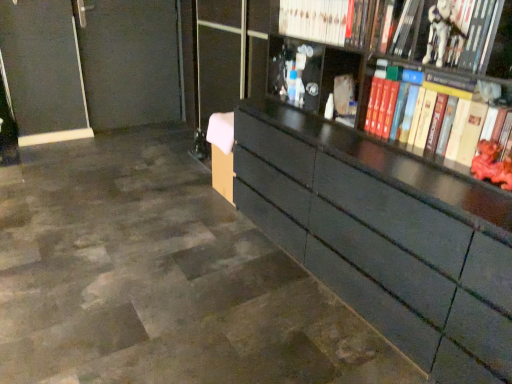
Question: From the image's perspective, is transparent glass door at center positioned above or below rubberized red toy at right, the 1th toy ordered from the bottom?

Choices:
 (A) above
 (B) below

Answer: (A)

Question: Would you say transparent glass door at center is inside or outside rubberized red toy at right, the 1th toy ordered from the bottom?

Choices:
 (A) inside
 (B) outside

Answer: (B)

Question: Estimate the real-world distances between objects in this image. Which object is farther from the transparent glass door at center?

Choices:
 (A) white plastic toy at upper right, placed as the first toy when sorted from left to right
 (B) white plastic toy at upper right, acting as the 2th book starting from the bottom
 (C) hardcover book at upper right, acting as the 3th book starting from the bottom
 (D) white glossy book at upper center, the 4th book positioned from the bottom
 (E) hardcover book at right, the first book when ordered from bottom to top

Answer: (B)

Question: Which of these objects is positioned farthest from the hardcover book at upper right, acting as the 3th book starting from the bottom?

Choices:
 (A) transparent glass door at center
 (B) white plastic toy at upper right, the second toy viewed from the right
 (C) white plastic toy at upper right, acting as the 2th book starting from the bottom
 (D) rubberized red toy at right, positioned as the 2th toy in left-to-right order
 (E) hardcover book at right, the first book when ordered from bottom to top

Answer: (A)